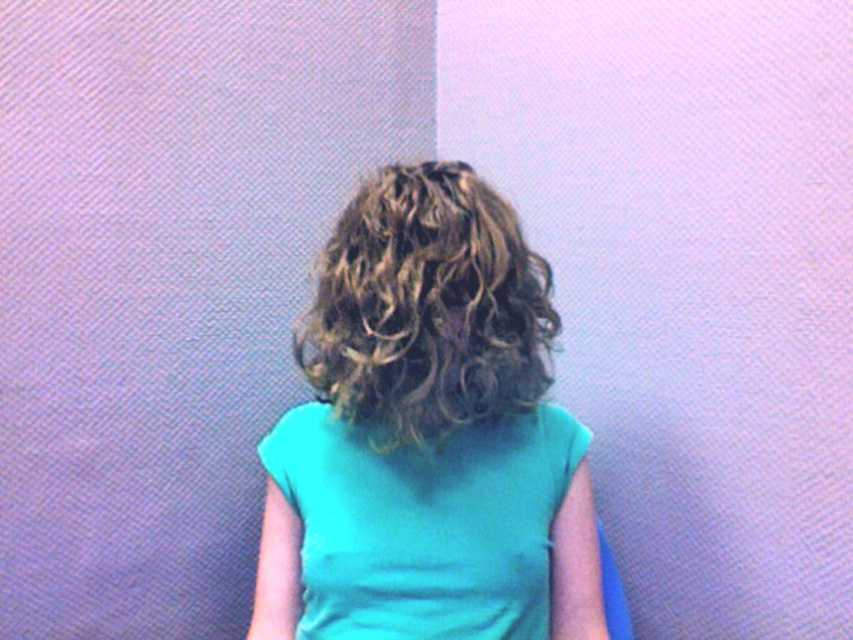
You are a photographer adjusting your camera settings. You want to capture both the teal fabric girl at center and the matte teal shirt at center in focus. Given that your camera has a depth of field that can cover 2.5 inches, will both subjects be in focus?

The distance between the teal fabric girl at center and the matte teal shirt at center is 2.48 inches, which is within the camera depth of field of 2.5 inches. Therefore, both subjects will be in focus.